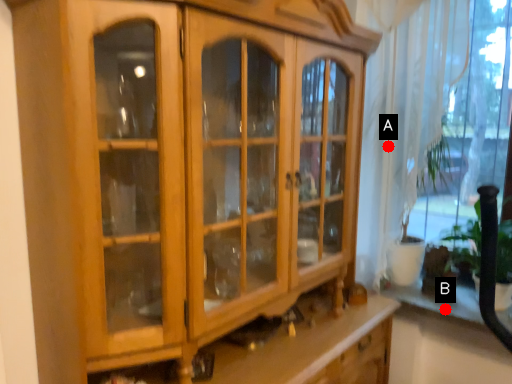
Question: Two points are circled on the image, labeled by A and B beside each circle. Which point is farther from the camera taking this photo?

Choices:
 (A) A is further
 (B) B is further

Answer: (B)